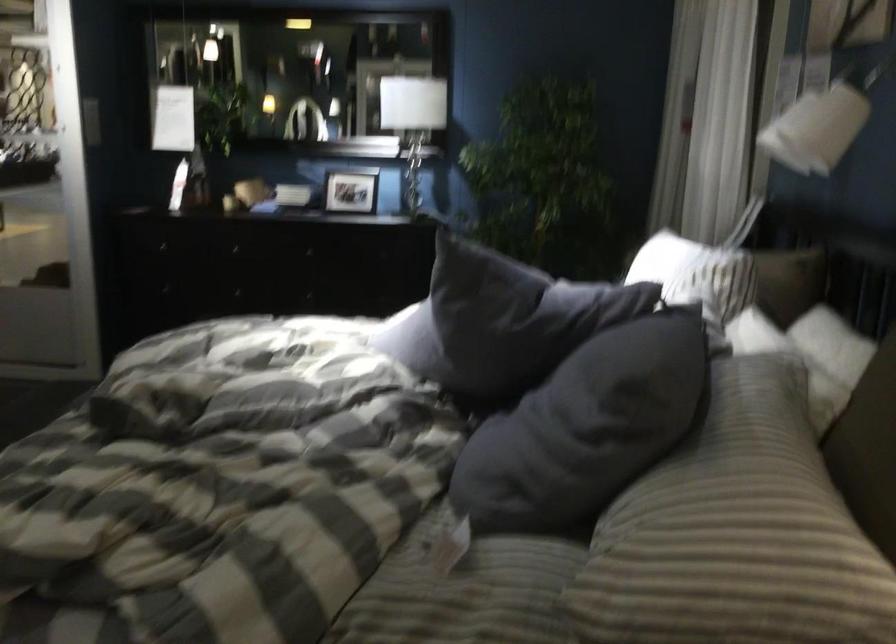
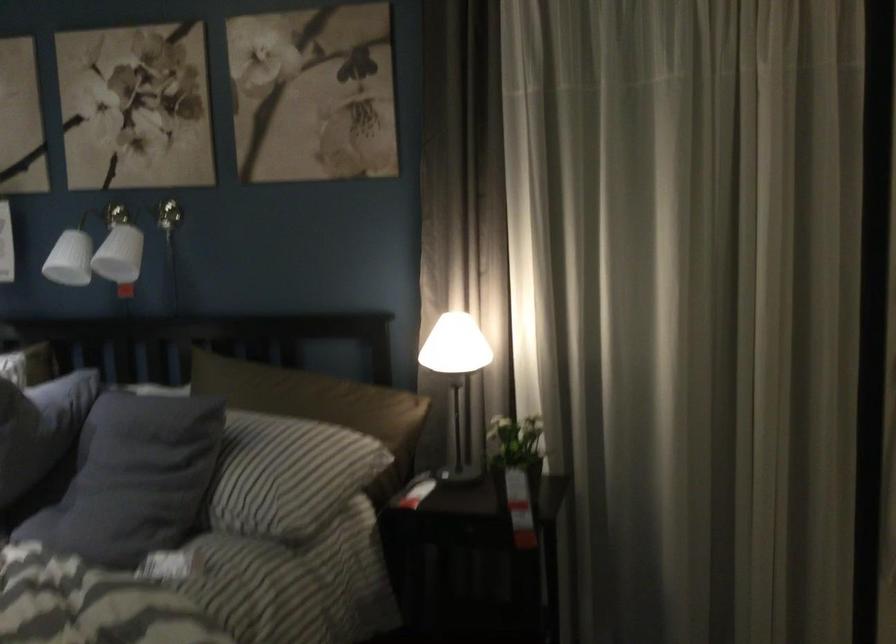
In the second image, find the point that corresponds to [506,317] in the first image.

(39, 428)